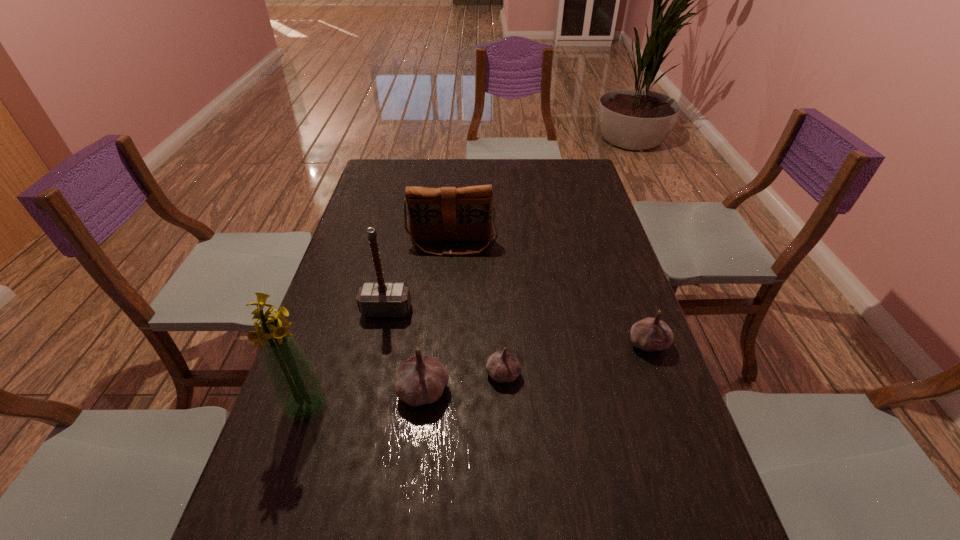
Image resolution: width=960 pixels, height=540 pixels. I want to click on vacant space that is in between the tallest garlic and the farthest object, so click(x=438, y=318).

Find the location of `vacant area that lies between the hammer and the tallest object`. vacant area that lies between the hammer and the tallest object is located at coordinates (347, 357).

Image resolution: width=960 pixels, height=540 pixels. Identify the location of vacant area between the hammer and the tallest object. (347, 357).

Where is `unoccupied position between the third shortest object and the shoulder bag`? Image resolution: width=960 pixels, height=540 pixels. unoccupied position between the third shortest object and the shoulder bag is located at coordinates (438, 318).

Find the location of `vacant area that lies between the farthest object and the shortest object`. vacant area that lies between the farthest object and the shortest object is located at coordinates (478, 309).

I want to click on empty space that is in between the shortest object and the second shortest object, so pyautogui.click(x=576, y=359).

Locate an element on the screen. free spot between the tallest garlic and the shoulder bag is located at coordinates (438, 318).

Where is `the third closest object to the third tallest object`? The image size is (960, 540). the third closest object to the third tallest object is located at coordinates (420, 380).

Locate which object is the fourth closest to the second tallest object. Please provide its 2D coordinates. Your answer should be formatted as a tuple, i.e. [(x, y)], where the tuple contains the x and y coordinates of a point satisfying the conditions above.

[(502, 366)]

Choose which garlic is the third nearest neighbor to the second farthest object. Please provide its 2D coordinates. Your answer should be formatted as a tuple, i.e. [(x, y)], where the tuple contains the x and y coordinates of a point satisfying the conditions above.

[(650, 334)]